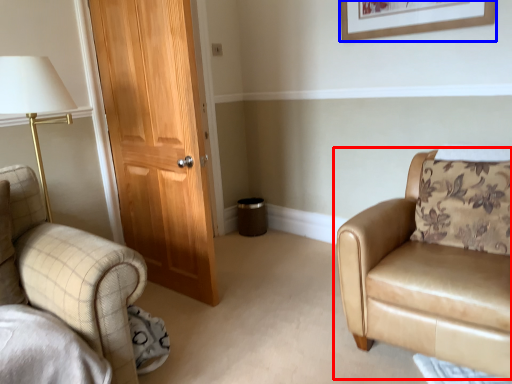
Question: Among these objects, which one is nearest to the camera, chair (highlighted by a red box) or picture frame (highlighted by a blue box)?

Choices:
 (A) chair
 (B) picture frame

Answer: (A)